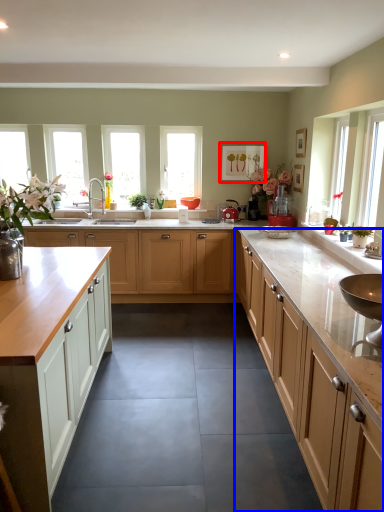
Question: Which object appears closest to the camera in this image, picture frame (highlighted by a red box) or cabinetry (highlighted by a blue box)?

Choices:
 (A) picture frame
 (B) cabinetry

Answer: (B)